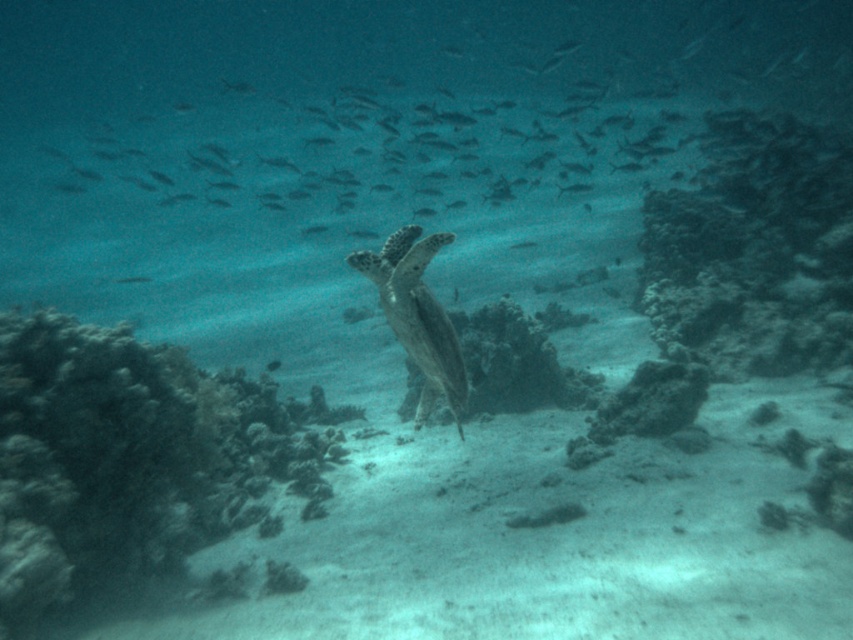
Between translucent greenish-blue fish at upper center and greenish-gray textured turtle at center, which one has more height?

Standing taller between the two is translucent greenish-blue fish at upper center.

Is translucent greenish-blue fish at upper center behind greenish-gray textured turtle at center?

Yes, translucent greenish-blue fish at upper center is further from the viewer.

Is point (476, 35) closer to viewer compared to point (416, 349)?

No, (476, 35) is further to viewer.

The width and height of the screenshot is (853, 640). I want to click on translucent greenish-blue fish at upper center, so click(x=404, y=54).

Is dark green coral reef at lower left below greenish-gray textured turtle at center?

Yes, dark green coral reef at lower left is below greenish-gray textured turtle at center.

Is point (180, 486) behind point (398, 259)?

That is True.

The width and height of the screenshot is (853, 640). What are the coordinates of `dark green coral reef at lower left` in the screenshot? It's located at (131, 460).

Which of these two, greenish-gray textured turtle at center or translucent greenish fish at center, stands taller?

greenish-gray textured turtle at center

Between greenish-gray textured turtle at center and translucent greenish fish at center, which one appears on the left side from the viewer's perspective?

translucent greenish fish at center is more to the left.

In order to click on greenish-gray textured turtle at center in this screenshot , I will do `click(416, 316)`.